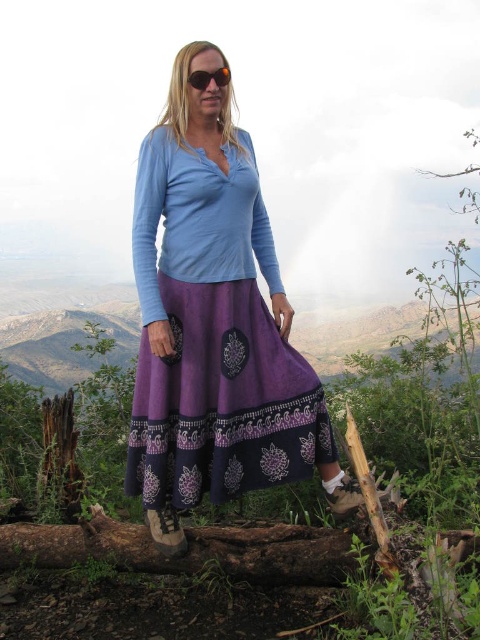
Does purple cotton skirt at center appear under black plastic sunglasses at center?

Yes.

Who is higher up, purple cotton skirt at center or black plastic sunglasses at center?

black plastic sunglasses at center is higher up.

Which is behind, point (162, 401) or point (228, 72)?

Positioned behind is point (228, 72).

In order to click on purple cotton skirt at center in this screenshot , I will do `click(214, 337)`.

Does purple cotton skirt at center have a lesser width compared to brown rough log at lower center?

Correct, purple cotton skirt at center's width is less than brown rough log at lower center's.

Is point (257, 324) in front of point (86, 544)?

Yes, point (257, 324) is in front of point (86, 544).

Who is more forward, (182, 236) or (17, 538)?

Point (182, 236)

Image resolution: width=480 pixels, height=640 pixels. Find the location of `purple cotton skirt at center`. purple cotton skirt at center is located at coordinates (214, 337).

Who is more distant from viewer, (x=227, y=550) or (x=207, y=81)?

The point (x=227, y=550) is behind.

Is point (289, 552) farther from viewer compared to point (204, 74)?

That is True.

Image resolution: width=480 pixels, height=640 pixels. I want to click on brown rough log at lower center, so click(x=187, y=550).